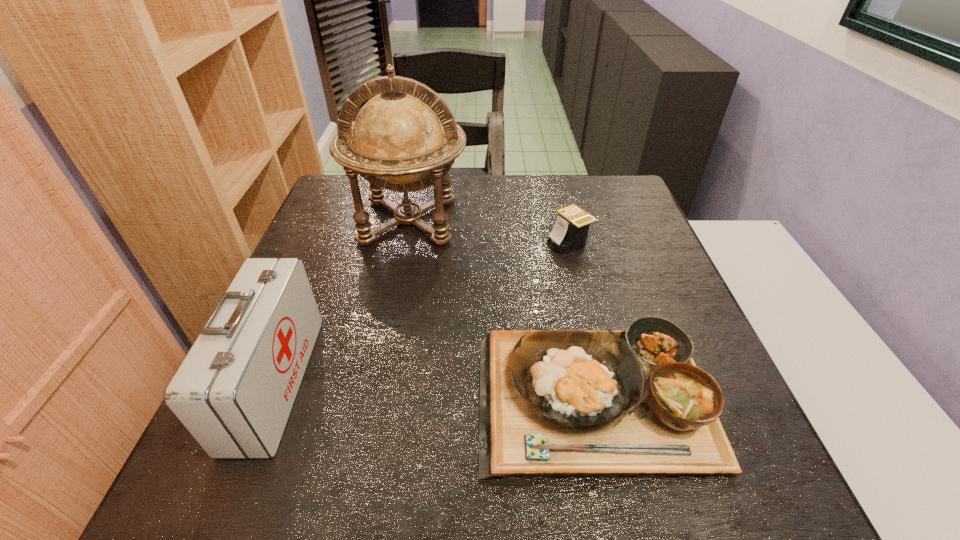
Where is `free space at the far right corner of the desktop`? The height and width of the screenshot is (540, 960). free space at the far right corner of the desktop is located at coordinates (598, 200).

At what (x,y) coordinates should I click in order to perform the action: click on vacant point located between the second tallest object and the platter. Please return your answer as a coordinate pair (x, y). Looking at the image, I should click on (437, 390).

Where is `free area in between the first-aid kit and the platter`? free area in between the first-aid kit and the platter is located at coordinates (437, 390).

The height and width of the screenshot is (540, 960). Find the location of `free space between the calculator and the tallest object`. free space between the calculator and the tallest object is located at coordinates (489, 231).

Find the location of `vacant point located between the first-aid kit and the calculator`. vacant point located between the first-aid kit and the calculator is located at coordinates (422, 312).

I want to click on free space between the second tallest object and the calculator, so click(x=422, y=312).

Identify the location of free space between the globe and the calculator. The height and width of the screenshot is (540, 960). (489, 231).

Locate an element on the screen. This screenshot has width=960, height=540. free space between the globe and the calculator is located at coordinates (489, 231).

You are a GUI agent. You are given a task and a screenshot of the screen. Output one action in this format:
    pyautogui.click(x=<x>, y=<y>)
    Task: Click on the unoccupied position between the first-aid kit and the globe
    The width and height of the screenshot is (960, 540).
    Given the screenshot: What is the action you would take?
    pyautogui.click(x=342, y=301)

The height and width of the screenshot is (540, 960). In order to click on free space between the calculator and the first-aid kit in this screenshot , I will do `click(422, 312)`.